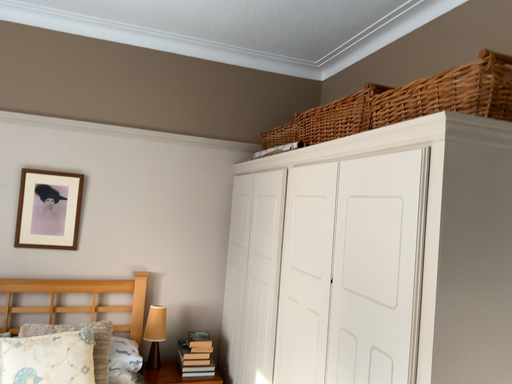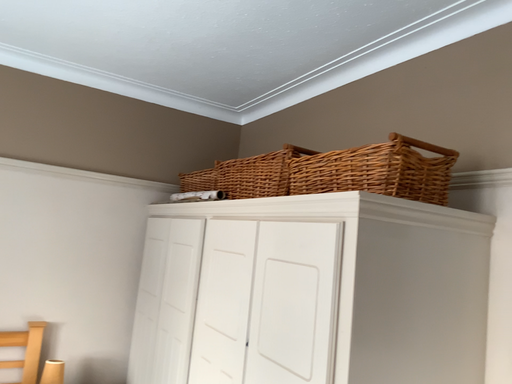
Question: Which way did the camera rotate in the video?

Choices:
 (A) rotated right
 (B) rotated left

Answer: (A)